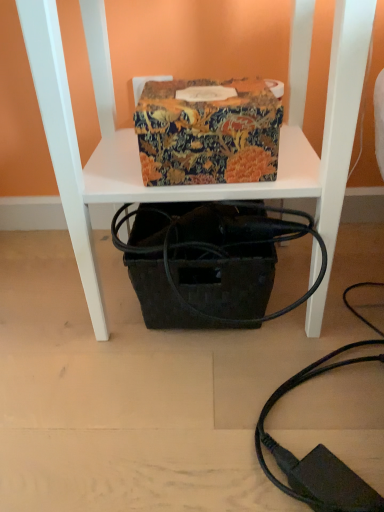
Question: Does patterned fabric box at center come in front of black woven basket at lower center?

Choices:
 (A) no
 (B) yes

Answer: (A)

Question: Can you confirm if patterned fabric box at center is thinner than black woven basket at lower center?

Choices:
 (A) yes
 (B) no

Answer: (A)

Question: From a real-world perspective, is patterned fabric box at center under black woven basket at lower center?

Choices:
 (A) yes
 (B) no

Answer: (B)

Question: Is patterned fabric box at center taller than black woven basket at lower center?

Choices:
 (A) no
 (B) yes

Answer: (A)

Question: Are patterned fabric box at center and black woven basket at lower center making contact?

Choices:
 (A) no
 (B) yes

Answer: (A)

Question: Is patterned fabric box at center looking in the opposite direction of black woven basket at lower center?

Choices:
 (A) yes
 (B) no

Answer: (A)

Question: Is black woven basket at lower center smaller than patterned fabric box at center?

Choices:
 (A) yes
 (B) no

Answer: (B)

Question: Is black woven basket at lower center next to patterned fabric box at center?

Choices:
 (A) no
 (B) yes

Answer: (A)

Question: Is black woven basket at lower center positioned with its back to patterned fabric box at center?

Choices:
 (A) yes
 (B) no

Answer: (A)

Question: Does black woven basket at lower center appear on the right side of patterned fabric box at center?

Choices:
 (A) yes
 (B) no

Answer: (A)

Question: Can you confirm if black woven basket at lower center is shorter than patterned fabric box at center?

Choices:
 (A) no
 (B) yes

Answer: (A)

Question: From the image's perspective, is black woven basket at lower center located beneath patterned fabric box at center?

Choices:
 (A) no
 (B) yes

Answer: (B)

Question: Does patterned fabric box at center have a lesser width compared to black woven basket at center?

Choices:
 (A) no
 (B) yes

Answer: (B)